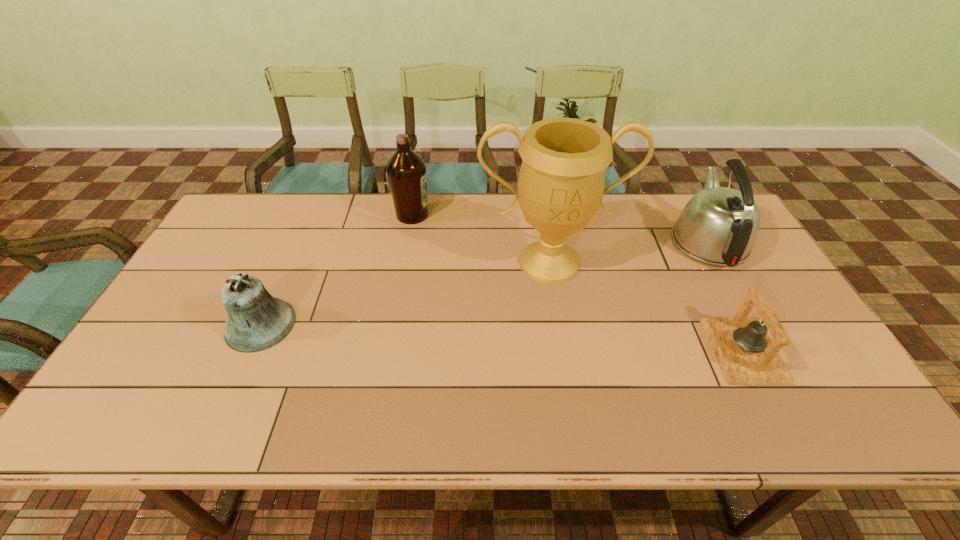
The height and width of the screenshot is (540, 960). I want to click on free space located 0.060m on the spout of the kettle, so click(x=685, y=202).

This screenshot has width=960, height=540. I want to click on free space located on the right of the taller bell, so click(x=379, y=325).

Image resolution: width=960 pixels, height=540 pixels. I want to click on vacant space located 0.250m on the left of the right bell, so click(x=612, y=350).

The height and width of the screenshot is (540, 960). In order to click on trophy present at the far edge in this screenshot , I will do `click(560, 188)`.

Where is `olive oil that is at the far edge`? olive oil that is at the far edge is located at coordinates (406, 170).

Locate an element on the screen. This screenshot has height=540, width=960. kettle located at the far edge is located at coordinates (719, 226).

Locate an element on the screen. The width and height of the screenshot is (960, 540). kettle that is at the right edge is located at coordinates (719, 226).

What are the coordinates of `bell that is at the right edge` in the screenshot? It's located at (747, 356).

The height and width of the screenshot is (540, 960). Find the location of `object that is at the far right corner`. object that is at the far right corner is located at coordinates (719, 226).

You are a GUI agent. You are given a task and a screenshot of the screen. Output one action in this format:
    pyautogui.click(x=<x>, y=<y>)
    Task: Click on the free space at the far edge
    This screenshot has height=540, width=960.
    Given the screenshot: What is the action you would take?
    pyautogui.click(x=288, y=206)